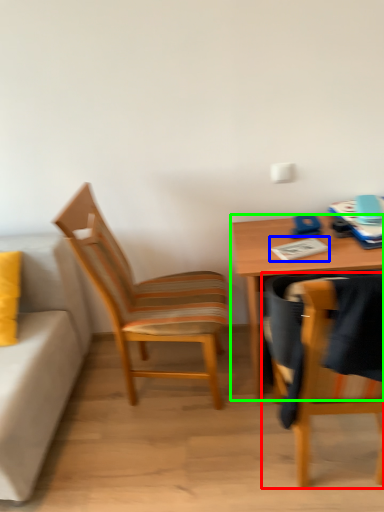
Question: Which object is the closest to the chair (highlighted by a red box)? Choose among these: notepad (highlighted by a blue box) or desk (highlighted by a green box).

Choices:
 (A) notepad
 (B) desk

Answer: (B)